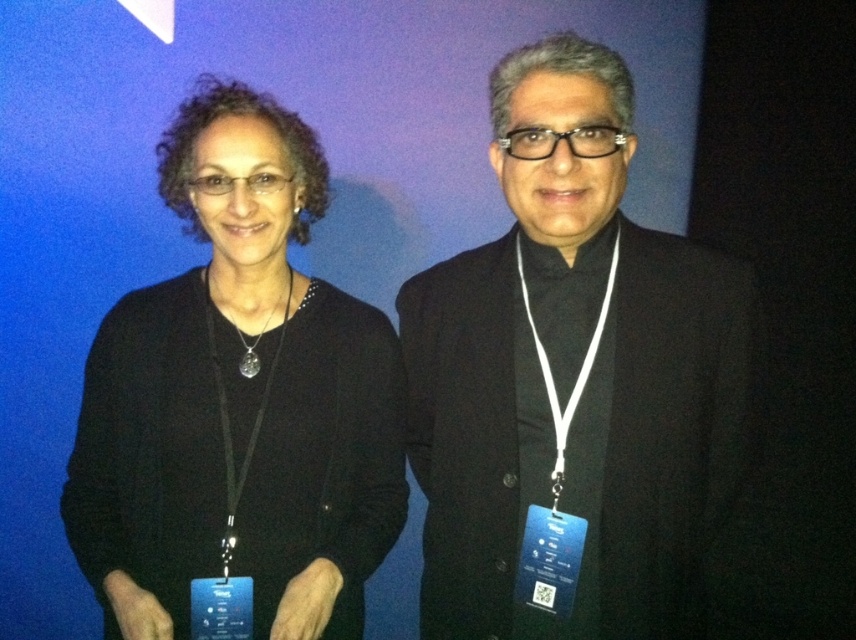
Question: Which of the following is the closest to the observer?

Choices:
 (A) (342, 406)
 (B) (626, 516)

Answer: (B)

Question: Which point is farther to the camera?

Choices:
 (A) black matte/black sweater at left
 (B) black matte suit at center

Answer: (A)

Question: Does black matte suit at center have a larger size compared to black matte/black sweater at left?

Choices:
 (A) no
 (B) yes

Answer: (B)

Question: Does black matte suit at center have a larger size compared to black matte/black sweater at left?

Choices:
 (A) yes
 (B) no

Answer: (A)

Question: Can you confirm if black matte suit at center is wider than black matte/black sweater at left?

Choices:
 (A) yes
 (B) no

Answer: (B)